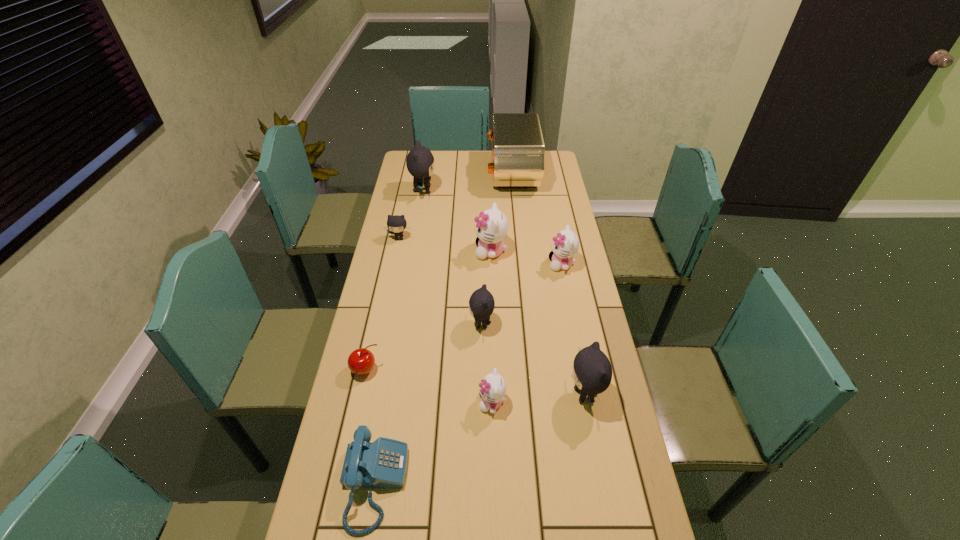
At what (x,y) coordinates should I click in order to perform the action: click on free space located on the front-facing side of the biggest white kitten. Please return your answer as a coordinate pair (x, y). Image resolution: width=960 pixels, height=540 pixels. Looking at the image, I should click on (444, 251).

At what (x,y) coordinates should I click in order to perform the action: click on vacant area situated 0.400m on the front-facing side of the nearest gray kitten. Please return your answer as a coordinate pair (x, y). The height and width of the screenshot is (540, 960). Looking at the image, I should click on (426, 395).

Identify the location of vacant space located on the front-facing side of the nearest gray kitten. click(515, 395).

The height and width of the screenshot is (540, 960). I want to click on free space located on the front-facing side of the nearest gray kitten, so click(525, 395).

I want to click on vacant area located on the front-facing side of the rightmost white kitten, so click(444, 264).

Locate an element on the screen. The width and height of the screenshot is (960, 540). vacant space located 0.220m on the front-facing side of the rightmost white kitten is located at coordinates (490, 264).

Locate an element on the screen. vacant space situated 0.210m on the front-facing side of the rightmost white kitten is located at coordinates (492, 264).

Where is `vacant region located on the front-facing side of the third biggest gray kitten`? The height and width of the screenshot is (540, 960). vacant region located on the front-facing side of the third biggest gray kitten is located at coordinates (423, 324).

I want to click on free point located on the front-facing side of the third biggest gray kitten, so (439, 324).

You are a GUI agent. You are given a task and a screenshot of the screen. Output one action in this format:
    pyautogui.click(x=<x>, y=<y>)
    Task: Click on the free space located on the front-facing side of the third biggest gray kitten
    This screenshot has width=960, height=540.
    Given the screenshot: What is the action you would take?
    pyautogui.click(x=384, y=324)